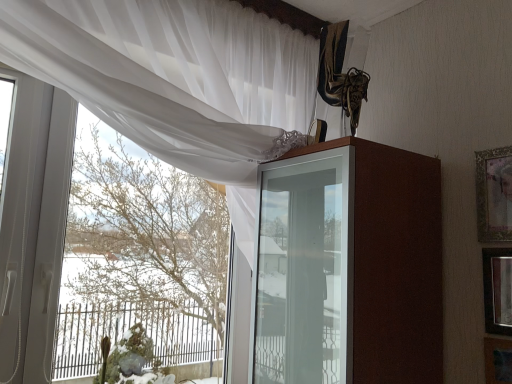
Question: Looking at their shapes, would you say brown glossy cabinet at upper center is wider or thinner than wooden picture frame at lower right, the 3th picture frame positioned from the top?

Choices:
 (A) thin
 (B) wide

Answer: (B)

Question: Does point (298, 160) appear closer or farther from the camera than point (489, 365)?

Choices:
 (A) closer
 (B) farther

Answer: (B)

Question: Which object is positioned farthest from the gold-framed picture at upper right, which is counted as the third picture frame, starting from the bottom?

Choices:
 (A) wooden picture frame at lower right, the 3th picture frame positioned from the top
 (B) green mossy plant at lower left
 (C) brown glossy cabinet at upper center
 (D) wooden framed mirror at right, the 2th picture frame viewed from the top
 (E) white sheer curtain at upper left

Answer: (B)

Question: Which object is positioned farthest from the brown glossy cabinet at upper center?

Choices:
 (A) gold-framed picture at upper right, which is counted as the third picture frame, starting from the bottom
 (B) wooden picture frame at lower right, the 3th picture frame positioned from the top
 (C) wooden framed mirror at right, the second picture frame positioned from the bottom
 (D) white sheer curtain at upper left
 (E) green mossy plant at lower left

Answer: (E)